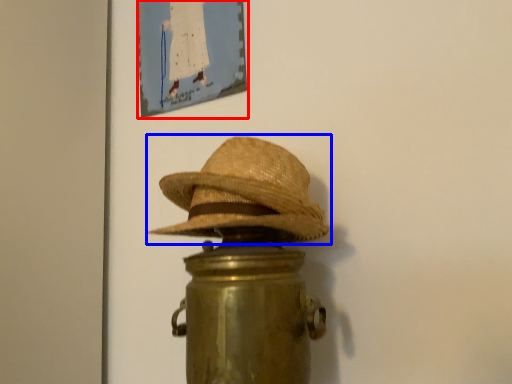
Question: Among these objects, which one is nearest to the camera, picture frame (highlighted by a red box) or cowboy hat (highlighted by a blue box)?

Choices:
 (A) picture frame
 (B) cowboy hat

Answer: (B)